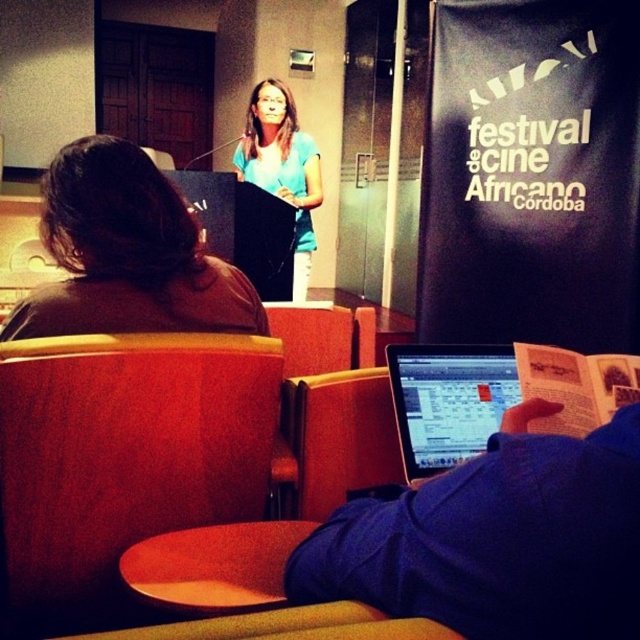
You are attending the Festival de Cine Africano in Cordoba and need to find a place to sit. You see the matte red chair at left and the silver metallic laptop at center. Which object is positioned lower in the image?

The matte red chair at left is located below the silver metallic laptop at center, so it is positioned lower in the image.

You are attending the Festival de Cine Africano in Cordoba and see the silver metallic laptop at center and the matte blue shirt at center. Which object is closer to the camera?

The matte blue shirt at center is closer to the camera because the silver metallic laptop at center is positioned under it, meaning the shirt is above the laptop in the visual plane.